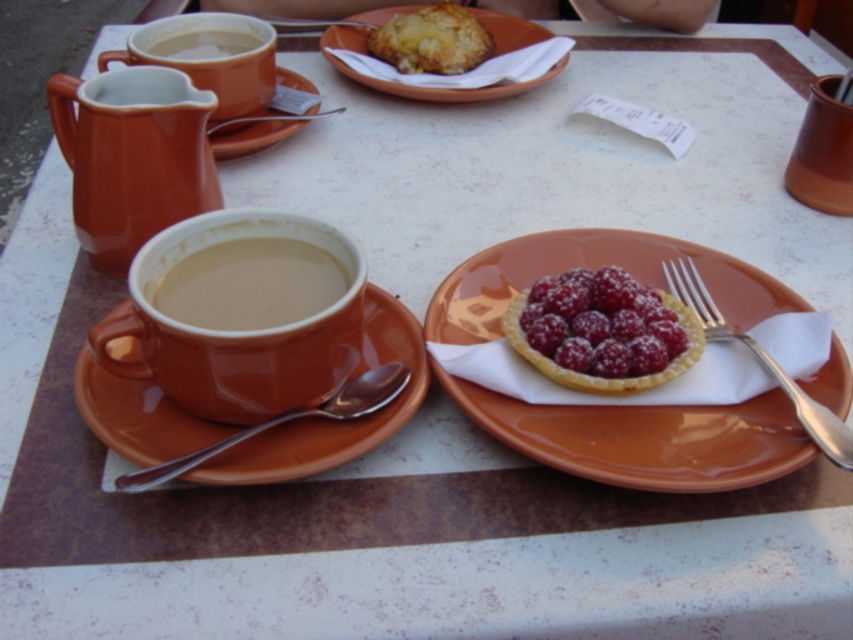
Question: Considering the relative positions of matte ceramic plate at center right and metallic spoon at upper center in the image provided, where is matte ceramic plate at center right located with respect to metallic spoon at upper center?

Choices:
 (A) left
 (B) right

Answer: (B)

Question: Among these points, which one is nearest to the camera?

Choices:
 (A) (338, 106)
 (B) (766, 368)
 (C) (221, 264)

Answer: (B)

Question: Can you confirm if sugar-coated raspberry tart at center-right is wider than matte ceramic mug at upper left?

Choices:
 (A) yes
 (B) no

Answer: (B)

Question: Is matte ceramic mug at left below brown ceramic saucer at left?

Choices:
 (A) yes
 (B) no

Answer: (B)

Question: Which object appears farthest from the camera in this image?

Choices:
 (A) matte ceramic mug at left
 (B) matte ceramic mug at center

Answer: (A)

Question: Which of these objects is positioned farthest from the matte ceramic pastry at upper center?

Choices:
 (A) metallic spoon at upper center
 (B) sugar-coated raspberry tart at center-right
 (C) matte ceramic saucer at upper center

Answer: (B)